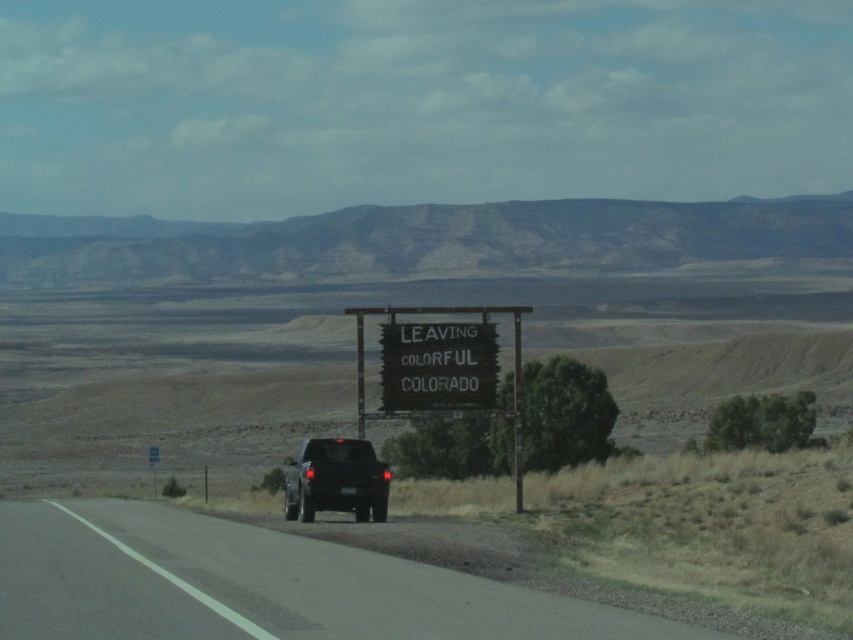
Identify the location of black plastic sign at center. (438, 365).

Is point (444, 369) farther from viewer compared to point (518, 388)?

Yes.

Who is more forward, (468, 410) or (357, 340)?

Point (357, 340) is in front.

Where is `black plastic sign at center`? Image resolution: width=853 pixels, height=640 pixels. black plastic sign at center is located at coordinates (438, 365).

At what (x,y) coordinates should I click in order to perform the action: click on black asphalt road at center. Please return your answer as a coordinate pair (x, y). Looking at the image, I should click on (258, 586).

Who is more distant from viewer, (395, 616) or (445, 371)?

The point (445, 371) is behind.

Locate an element on the screen. black asphalt road at center is located at coordinates (258, 586).

Does black asphalt road at center appear on the right side of matte black truck at center?

Indeed, black asphalt road at center is positioned on the right side of matte black truck at center.

Is black asphalt road at center smaller than matte black truck at center?

Yes.

What do you see at coordinates (258, 586) in the screenshot? I see `black asphalt road at center` at bounding box center [258, 586].

At what (x,y) coordinates should I click in order to perform the action: click on black asphalt road at center. Please return your answer as a coordinate pair (x, y). Looking at the image, I should click on 258,586.